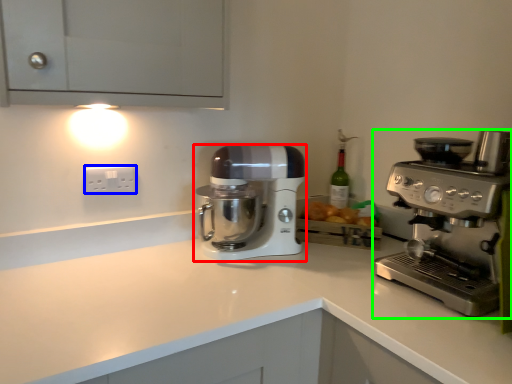
Question: Which object is positioned closest to mixer (highlighted by a red box)? Select from electric outlet (highlighted by a blue box) and coffee maker (highlighted by a green box).

Choices:
 (A) electric outlet
 (B) coffee maker

Answer: (A)